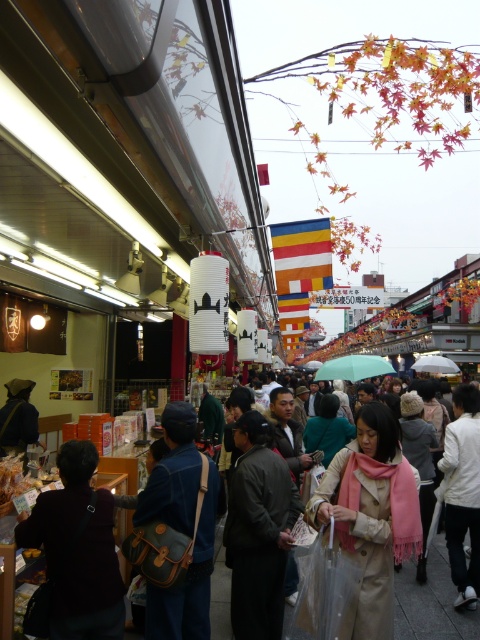
You are a delivery person who needs to navigate through the crowd in the market. You see a dark gray coat at center and a white matte jacket at lower right. Which clothing item is wider so you can decide which path to take around them?

The dark gray coat at center is wider than the white matte jacket at lower right, so you should choose the path around the white matte jacket at lower right to navigate more easily through the crowd.

You are a customer at the market and want to buy a beige wool coat. The store assistant points to a specific location on the coat using coordinates. Where exactly on the beige wool coat at center is the point at coordinates (371, 515) located?

The point at coordinates (371, 515) is located on the beige wool coat at center.

You are a customer in this market and you want to try on both the dark gray coat at center and the denim jacket at center. Which one should you pick up first if you want to start with the one closer to your left?

The denim jacket at center is on the left side of the dark gray coat at center, so you should pick up the denim jacket at center first.